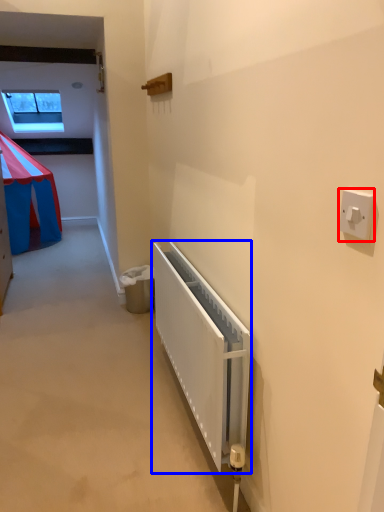
Question: Which point is further to the camera, light switch (highlighted by a red box) or radiator (highlighted by a blue box)?

Choices:
 (A) light switch
 (B) radiator

Answer: (B)